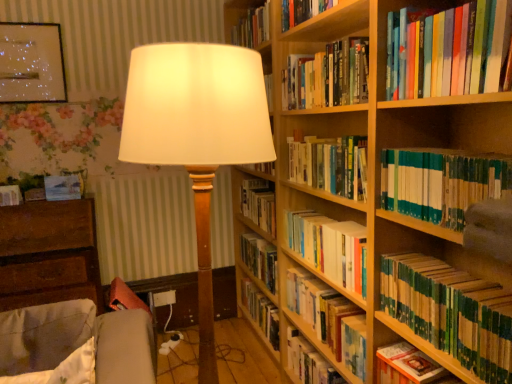
Question: Would you say hardcover book at upper right, the 1th book from the top, is outside hardcover book at lower right, the seventh book in the top-to-bottom sequence?

Choices:
 (A) no
 (B) yes

Answer: (B)

Question: Is hardcover book at upper right, which is the 8th book from bottom to top, positioned far away from hardcover book at lower right, the 2th book in the bottom-to-top sequence?

Choices:
 (A) no
 (B) yes

Answer: (A)

Question: From the image's perspective, is hardcover book at upper right, which is the 8th book from bottom to top, below hardcover book at lower right, the 2th book in the bottom-to-top sequence?

Choices:
 (A) yes
 (B) no

Answer: (B)

Question: Does hardcover book at upper right, which is the 8th book from bottom to top, have a lesser width compared to hardcover book at lower right, the 2th book in the bottom-to-top sequence?

Choices:
 (A) yes
 (B) no

Answer: (A)

Question: Is hardcover book at upper right, the 1th book from the top, positioned before hardcover book at lower right, the seventh book in the top-to-bottom sequence?

Choices:
 (A) no
 (B) yes

Answer: (B)

Question: Is hardcover book at center, placed as the 1th book when sorted from bottom to top, situated inside matte white lampshade at center or outside?

Choices:
 (A) inside
 (B) outside

Answer: (B)

Question: Is point (303, 355) positioned closer to the camera than point (201, 142)?

Choices:
 (A) closer
 (B) farther

Answer: (B)

Question: From a real-world perspective, relative to matte white lampshade at center, is hardcover book at center, placed as the 1th book when sorted from bottom to top, vertically above or below?

Choices:
 (A) below
 (B) above

Answer: (A)

Question: In terms of height, does hardcover book at center, the 8th book viewed from the top, look taller or shorter compared to matte white lampshade at center?

Choices:
 (A) tall
 (B) short

Answer: (B)

Question: Considering their positions, is teal hardcover books at right, positioned as the 6th book in bottom-to-top order, located in front of or behind green matte book at lower right, the fourth book from the bottom?

Choices:
 (A) front
 (B) behind

Answer: (A)

Question: Does point (440, 187) appear closer or farther from the camera than point (439, 337)?

Choices:
 (A) closer
 (B) farther

Answer: (A)

Question: From the image's perspective, is teal hardcover books at right, placed as the third book when sorted from top to bottom, positioned above or below green matte book at lower right, the fourth book from the bottom?

Choices:
 (A) above
 (B) below

Answer: (A)

Question: From a real-world perspective, is teal hardcover books at right, placed as the third book when sorted from top to bottom, physically located above or below green matte book at lower right, which appears as the 5th book when viewed from the top?

Choices:
 (A) above
 (B) below

Answer: (A)

Question: Looking at the image, does hardcover books at center, which appears as the fifth book when ordered from the bottom, seem bigger or smaller compared to wooden bookcase at right?

Choices:
 (A) big
 (B) small

Answer: (B)

Question: From their relative heights in the image, would you say hardcover books at center, which is the fourth book in top-to-bottom order, is taller or shorter than wooden bookcase at right?

Choices:
 (A) short
 (B) tall

Answer: (A)